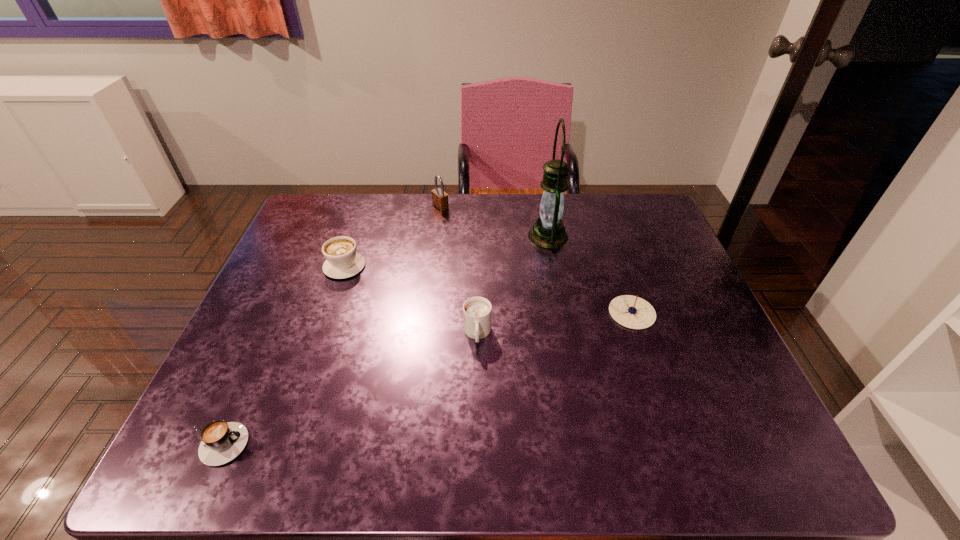
The width and height of the screenshot is (960, 540). Identify the location of the second object from right to left. (548, 231).

Find the location of a particular element. Image resolution: width=960 pixels, height=540 pixels. the tallest object is located at coordinates (548, 231).

The image size is (960, 540). I want to click on the fourth object from right to left, so click(439, 198).

Identify the location of the fifth shortest object. (439, 198).

Where is `the rightmost cappuccino`? This screenshot has width=960, height=540. the rightmost cappuccino is located at coordinates (477, 311).

Find the location of a particular element. The width and height of the screenshot is (960, 540). the second farthest cappuccino is located at coordinates (477, 311).

In order to click on the second cappuccino from left to right in this screenshot , I will do `click(343, 261)`.

At what (x,y) coordinates should I click in order to perform the action: click on the farthest cappuccino. Please return your answer as a coordinate pair (x, y). This screenshot has height=540, width=960. Looking at the image, I should click on (343, 261).

You are a GUI agent. You are given a task and a screenshot of the screen. Output one action in this format:
    pyautogui.click(x=<x>, y=<y>)
    Task: Click on the fifth tallest object
    The image size is (960, 540).
    Given the screenshot: What is the action you would take?
    pyautogui.click(x=632, y=312)

Find the location of a particular element. the rightmost object is located at coordinates (632, 312).